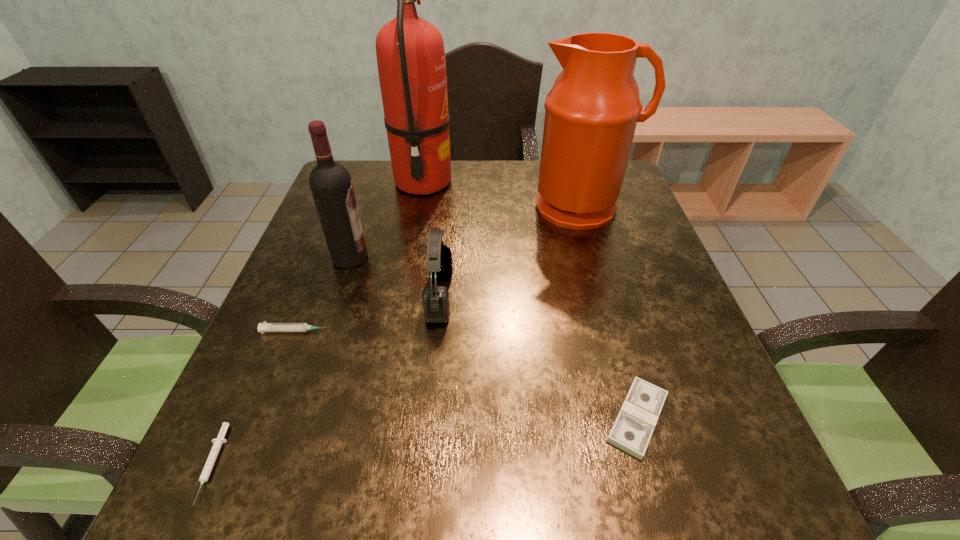
This screenshot has height=540, width=960. I want to click on blank space located on the label of the wine bottle, so (x=521, y=257).

At what (x,y) coordinates should I click in order to perform the action: click on vacant space located 0.080m on the headband of the fourth tallest object. Please return your answer as a coordinate pair (x, y). Looking at the image, I should click on (489, 296).

Image resolution: width=960 pixels, height=540 pixels. What are the coordinates of `free space located at the needle end of the third shortest object` in the screenshot? It's located at (418, 331).

What are the coordinates of `vacant region located 0.130m on the back of the dollar` in the screenshot? It's located at (611, 326).

This screenshot has width=960, height=540. Find the location of `free space located 0.240m on the right of the shorter syringe`. free space located 0.240m on the right of the shorter syringe is located at coordinates (375, 464).

Locate an element on the screen. This screenshot has height=540, width=960. fire extinguisher located in the far edge section of the desktop is located at coordinates (410, 52).

Identify the location of water jug that is at the far edge. (591, 112).

Where is `object positioned at the near edge`? This screenshot has width=960, height=540. object positioned at the near edge is located at coordinates (218, 442).

This screenshot has width=960, height=540. Identify the location of wine bottle that is at the left edge. (331, 185).

Where is `water jug that is at the right edge`? water jug that is at the right edge is located at coordinates (591, 112).